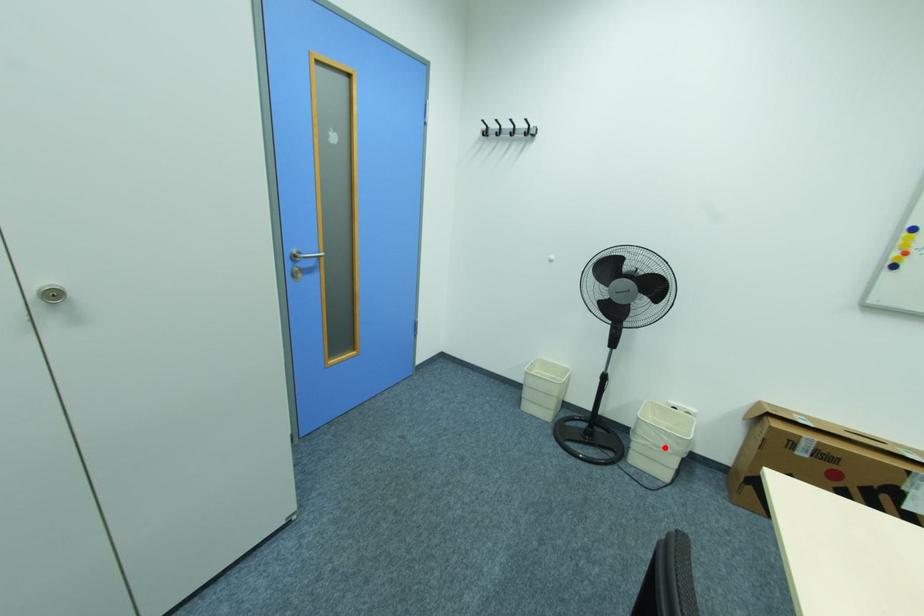
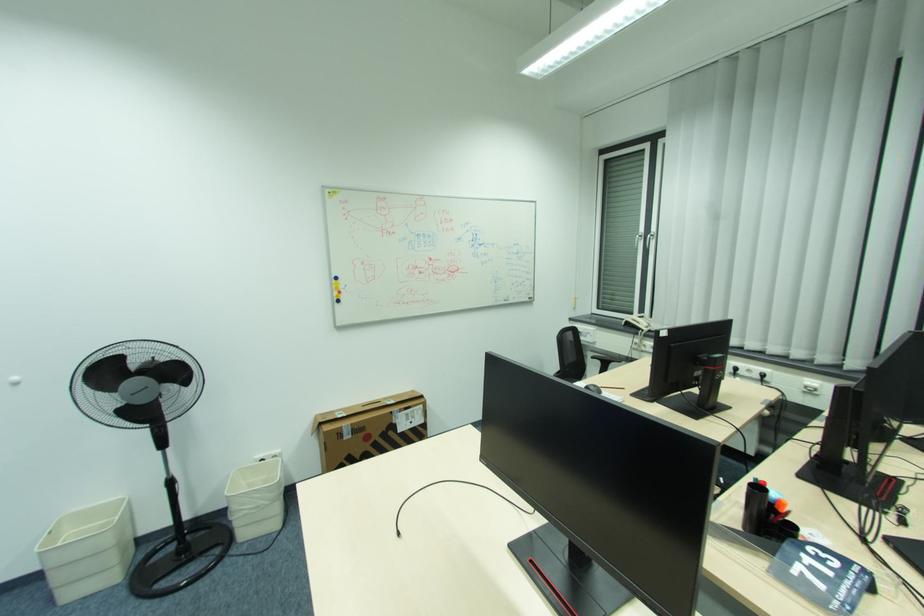
The point at the highlighted location is marked in the first image. Where is the corresponding point in the second image?

(263, 507)